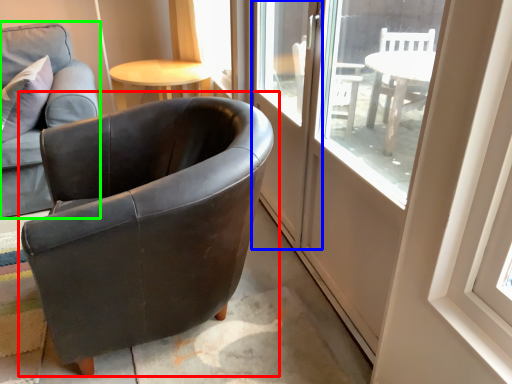
Question: Which object is the farthest from chair (highlighted by a red box)? Choose among these: screen door (highlighted by a blue box) or chair (highlighted by a green box).

Choices:
 (A) screen door
 (B) chair

Answer: (B)